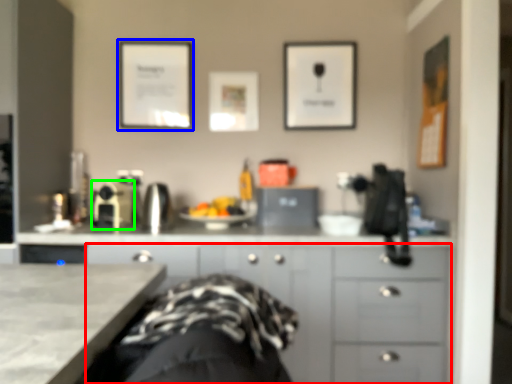
Question: Considering the real-world distances, which object is closest to cabinetry (highlighted by a red box)? picture frame (highlighted by a blue box) or appliance (highlighted by a green box).

Choices:
 (A) picture frame
 (B) appliance

Answer: (B)